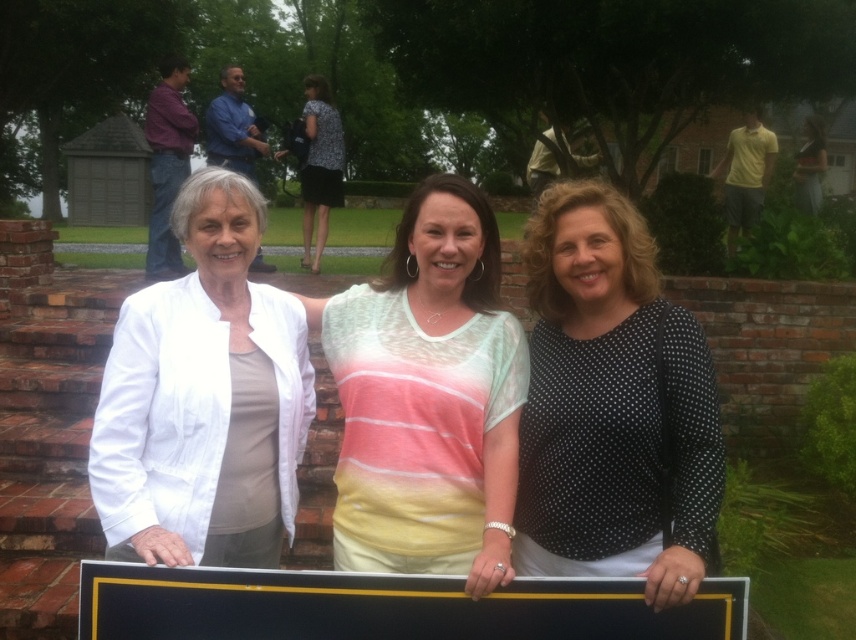
Question: Observing the image, what is the correct spatial positioning of white matte jacket at left in reference to black matte plaque at center?

Choices:
 (A) left
 (B) right

Answer: (A)

Question: Which point is farther to the camera?

Choices:
 (A) (514, 465)
 (B) (221, 356)
 (C) (96, 637)

Answer: (A)

Question: Which object is closer to the camera taking this photo?

Choices:
 (A) black matte plaque at center
 (B) black dotted blouse at center

Answer: (B)

Question: Can you confirm if white matte jacket at left is positioned above pastel striped shirt at center?

Choices:
 (A) yes
 (B) no

Answer: (A)

Question: Estimate the real-world distances between objects in this image. Which object is farther from the black matte plaque at center?

Choices:
 (A) pastel striped shirt at center
 (B) white matte jacket at left

Answer: (B)

Question: Can you confirm if pastel striped shirt at center is wider than black matte plaque at center?

Choices:
 (A) yes
 (B) no

Answer: (B)